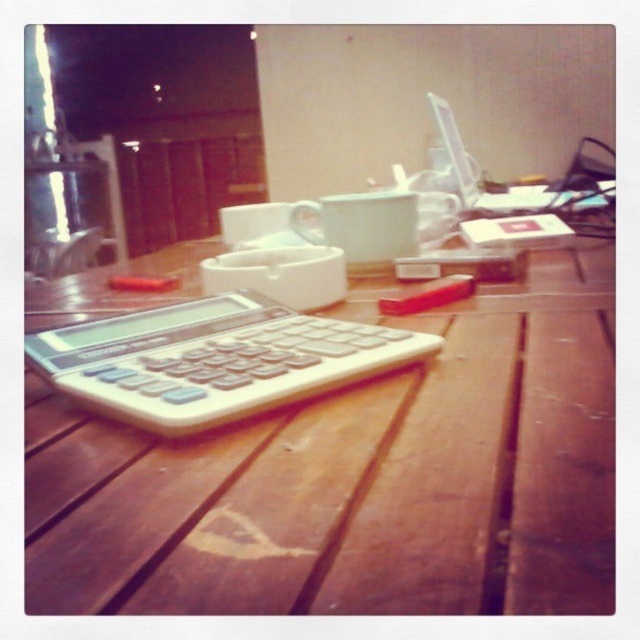
Measure the distance between wooden table at center and white plastic calculator at center.

They are 2.26 inches apart.

Which is in front, point (400, 605) or point (256, 408)?

Positioned in front is point (400, 605).

Is point (420, 464) closer to camera compared to point (291, 360)?

Yes, it is.

Locate an element on the screen. wooden table at center is located at coordinates (346, 472).